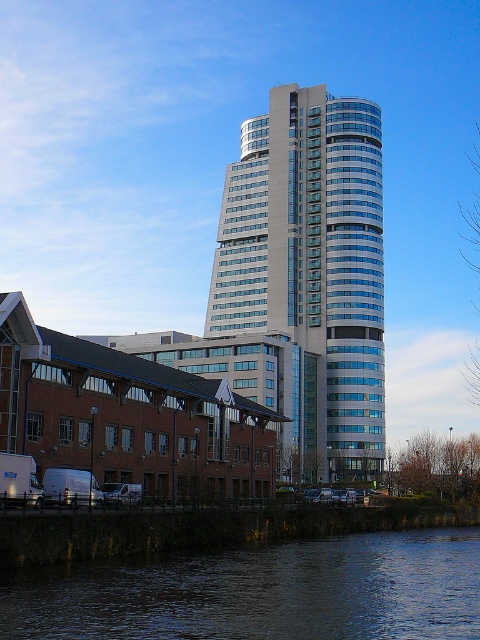
You are a photographer planning to capture the glassy white skyscraper at center and the dark blue water at lower center in a single shot. Based on their sizes, which object should you focus on to ensure both are clearly visible in the frame?

The glassy white skyscraper at center is bigger than the dark blue water at lower center, so focusing on the skyscraper will help ensure both are visible as the larger object will take up more space, allowing the smaller water area to fit within the frame.

You are standing at the point closest to the red brick building in the foreground. There are two points marked in the image, one at coordinates point (x=373, y=184) and the other at point (x=304, y=586). Which point is farther away from your current position?

Point (x=373, y=184) is behind point (x=304, y=586), so it is farther away from your current position near the red brick building in the foreground.